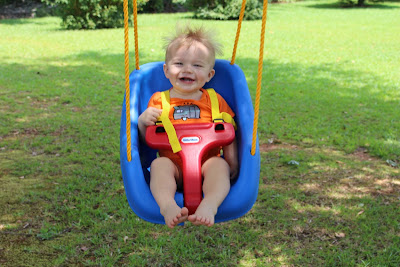
At what (x,y) coordinates should I click in order to perform the action: click on safety bar. Please return your answer as a coordinate pair (x, y). The width and height of the screenshot is (400, 267). Looking at the image, I should click on (196, 150).